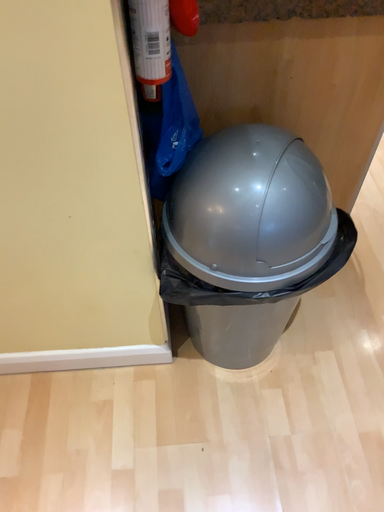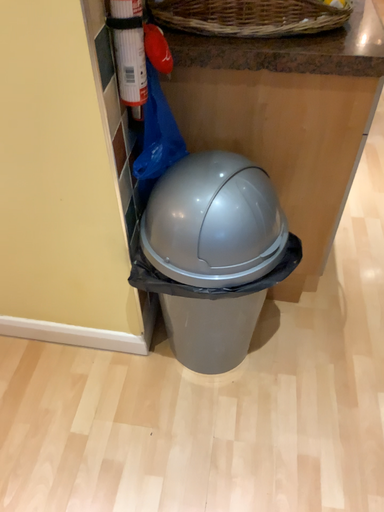
Question: Which way did the camera rotate in the video?

Choices:
 (A) rotated right
 (B) rotated left

Answer: (B)